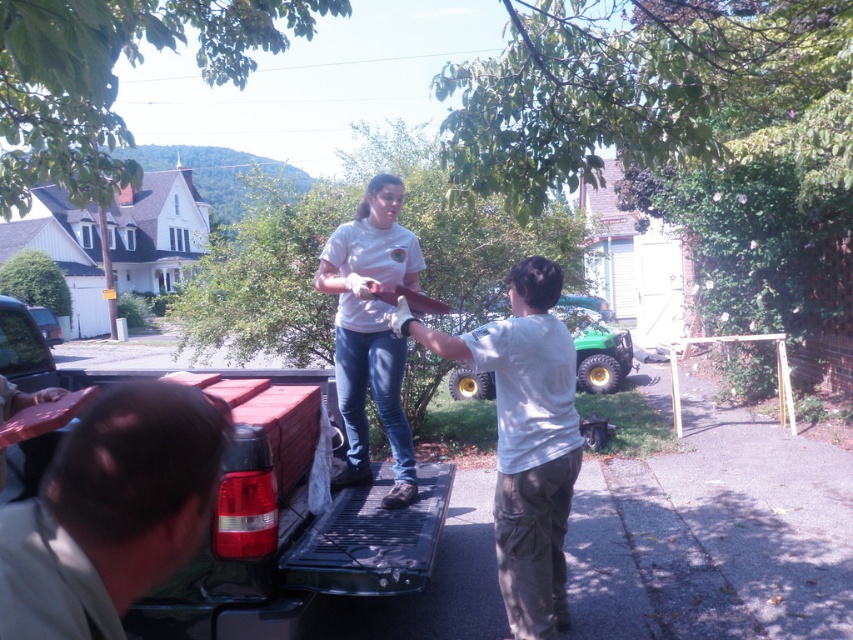
You are standing 2 meters away from the pickup truck with its tailgate open. There is a point marked at coordinates point (x=540, y=540) inside the truck bed. Can you reach that point without moving closer to the truck?

The point (x=540, y=540) is 3.35 meters away from the viewer. Since you are currently 2 meters away from the pickup truck, you are closer than the point, so you cannot reach it without moving closer.

You are a delivery person who just arrived at a residential area. You need to place a light brown leather jacket at lower left in a secure location. Based on the scene, where would be the best place to place it?

The best place to place the light brown leather jacket at lower left would be inside the pickup truck with its tailgate open, as it is a secure location in the scene described.

You are a delivery driver who needs to check if the light brown leather jacket at lower left and the white matte shirt at center are positioned in a way that allows you to safely load a large package between them. Based on the scene description, can you safely place the package between these two items?

The light brown leather jacket at lower left is located below the white matte shirt at center, so there is vertical space between them. However, without knowing the horizontal distance or the package dimensions, it is uncertain if it can fit. The scene does not provide enough information about horizontal spacing or package size.